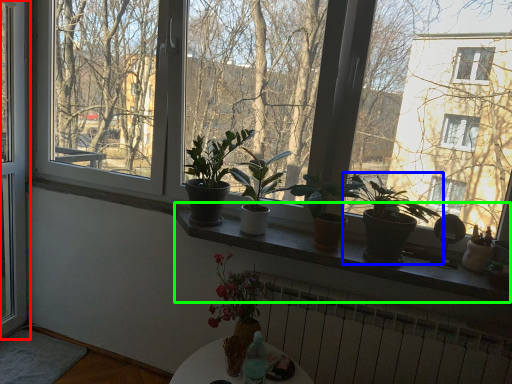
Question: Which is nearer to the window (highlighted by a red box)? houseplant (highlighted by a blue box) or window sill (highlighted by a green box).

Choices:
 (A) houseplant
 (B) window sill

Answer: (B)